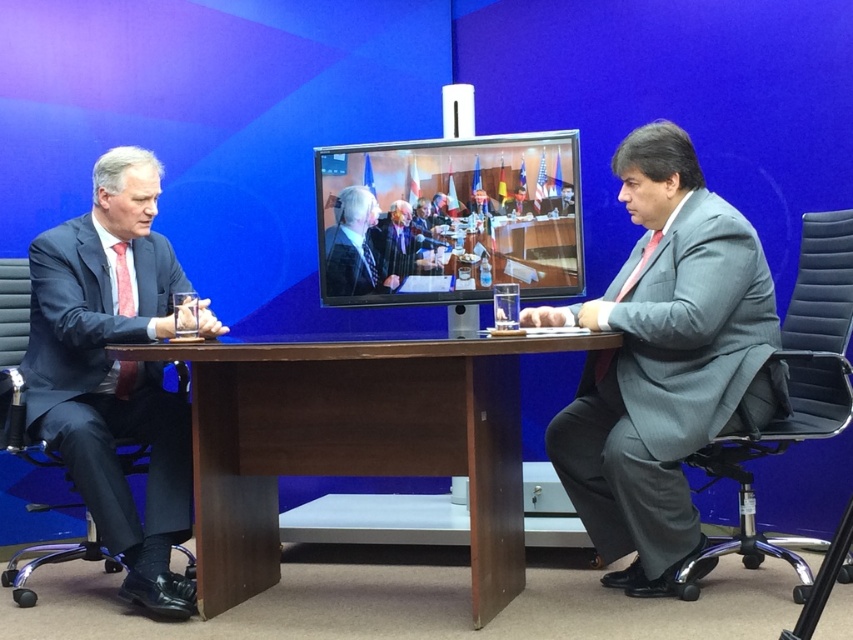
Between brown wood table at center and gray textured suit at right, which one appears on the right side from the viewer's perspective?

Positioned to the right is gray textured suit at right.

Can you confirm if brown wood table at center is positioned to the right of gray textured suit at right?

Incorrect, brown wood table at center is not on the right side of gray textured suit at right.

Does point (305, 465) lie behind point (547, 436)?

No, (305, 465) is closer to viewer.

Where is `brown wood table at center`? Image resolution: width=853 pixels, height=640 pixels. brown wood table at center is located at coordinates click(352, 440).

Which is behind, point (570, 454) or point (115, 380)?

The point (115, 380) is behind.

Who is lower down, gray textured suit at right or matte black suit at left?

Positioned lower is matte black suit at left.

Does point (627, 186) come farther from viewer compared to point (186, 435)?

No, (627, 186) is in front of (186, 435).

Find the location of a particular element. gray textured suit at right is located at coordinates pos(664,362).

Is matte black suit at left bigger than matte black suit at center?

Correct, matte black suit at left is larger in size than matte black suit at center.

Which is in front, point (94, 387) or point (392, 289)?

Positioned in front is point (94, 387).

Is point (39, 374) positioned after point (357, 264)?

That is False.

The width and height of the screenshot is (853, 640). What are the coordinates of `matte black suit at left` in the screenshot? It's located at (113, 371).